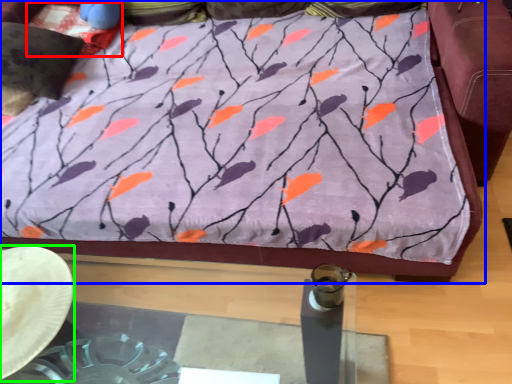
Question: Which object is positioned farthest from pillow (highlighted by a red box)? Select from furniture (highlighted by a blue box) and cowboy hat (highlighted by a green box).

Choices:
 (A) furniture
 (B) cowboy hat

Answer: (B)